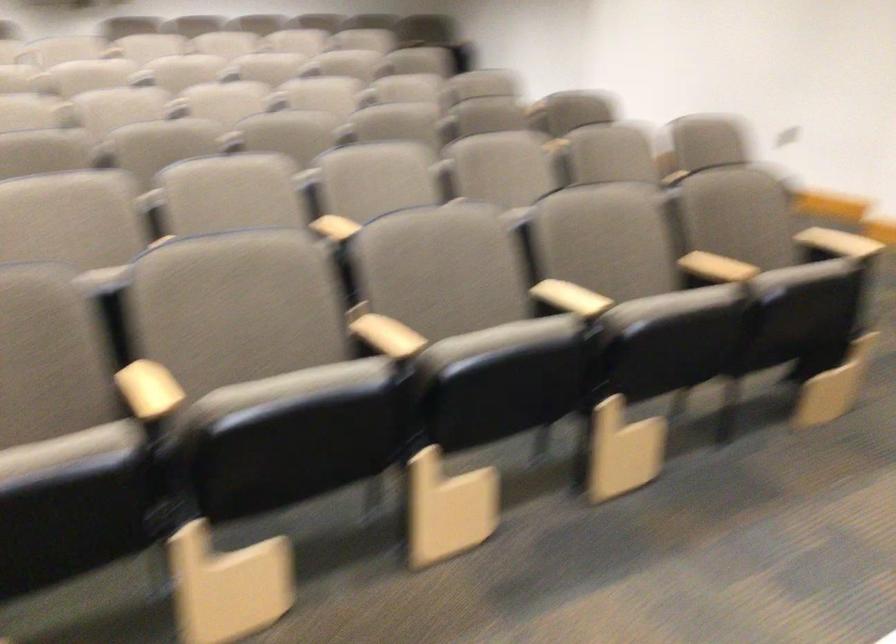
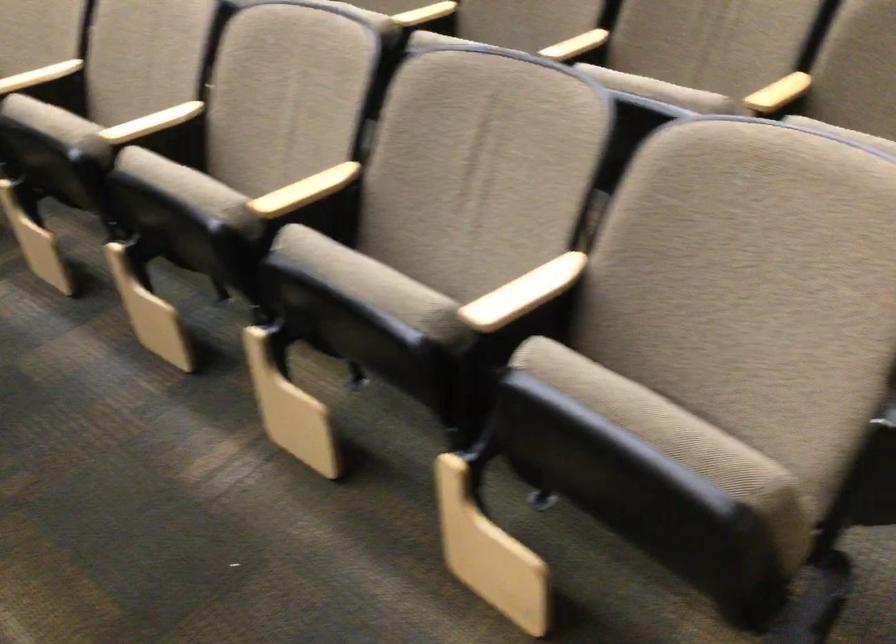
The point at (719, 156) is marked in the first image. Where is the corresponding point in the second image?

(522, 292)